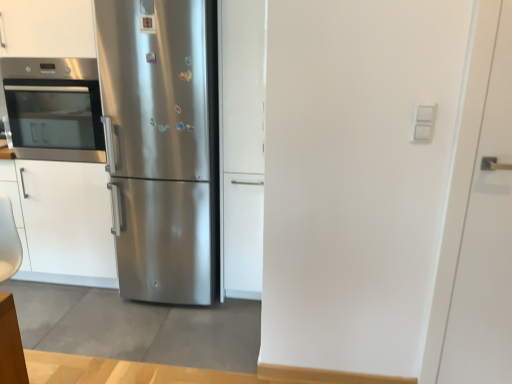
Question: Is stainless steel refrigerator at center to the right of white matte door at right, arranged as the second door when viewed from the left, from the viewer's perspective?

Choices:
 (A) yes
 (B) no

Answer: (B)

Question: From a real-world perspective, is stainless steel refrigerator at center positioned under white matte door at right, arranged as the first door when viewed from the front, based on gravity?

Choices:
 (A) no
 (B) yes

Answer: (A)

Question: Is stainless steel refrigerator at center with white matte door at right, which is the 1th door in right-to-left order?

Choices:
 (A) no
 (B) yes

Answer: (A)

Question: Considering the relative sizes of stainless steel refrigerator at center and white matte door at right, arranged as the first door when viewed from the front, in the image provided, is stainless steel refrigerator at center shorter than white matte door at right, arranged as the first door when viewed from the front,?

Choices:
 (A) no
 (B) yes

Answer: (A)

Question: Is stainless steel refrigerator at center looking in the opposite direction of white matte door at right, arranged as the second door when viewed from the left?

Choices:
 (A) yes
 (B) no

Answer: (B)

Question: From the image's perspective, relative to white matte door at right, which appears as the 2th door when viewed from the back, is stainless steel refrigerator at center above or below?

Choices:
 (A) above
 (B) below

Answer: (A)

Question: From a real-world perspective, is stainless steel refrigerator at center physically located above or below white matte door at right, arranged as the second door when viewed from the left?

Choices:
 (A) below
 (B) above

Answer: (B)

Question: Does point (120, 0) appear closer or farther from the camera than point (482, 142)?

Choices:
 (A) closer
 (B) farther

Answer: (B)

Question: From their relative heights in the image, would you say stainless steel refrigerator at center is taller or shorter than white matte door at right, which appears as the 2th door when viewed from the back?

Choices:
 (A) tall
 (B) short

Answer: (A)

Question: From the image's perspective, is satin white cabinet at center, which is the 1th door in left-to-right order, positioned above or below stainless steel refrigerator at center?

Choices:
 (A) above
 (B) below

Answer: (A)

Question: Considering the positions of satin white cabinet at center, the first door positioned from the back, and stainless steel refrigerator at center in the image, is satin white cabinet at center, the first door positioned from the back, wider or thinner than stainless steel refrigerator at center?

Choices:
 (A) thin
 (B) wide

Answer: (A)

Question: Is point (224, 215) positioned closer to the camera than point (188, 54)?

Choices:
 (A) closer
 (B) farther

Answer: (B)

Question: In terms of size, does satin white cabinet at center, the 2th door viewed from the front, appear bigger or smaller than stainless steel refrigerator at center?

Choices:
 (A) small
 (B) big

Answer: (A)

Question: Looking at the image, does stainless steel oven at left seem bigger or smaller compared to white matte door at right, arranged as the second door when viewed from the left?

Choices:
 (A) small
 (B) big

Answer: (B)

Question: Is point [x=83, y=145] positioned closer to the camera than point [x=501, y=178]?

Choices:
 (A) farther
 (B) closer

Answer: (A)